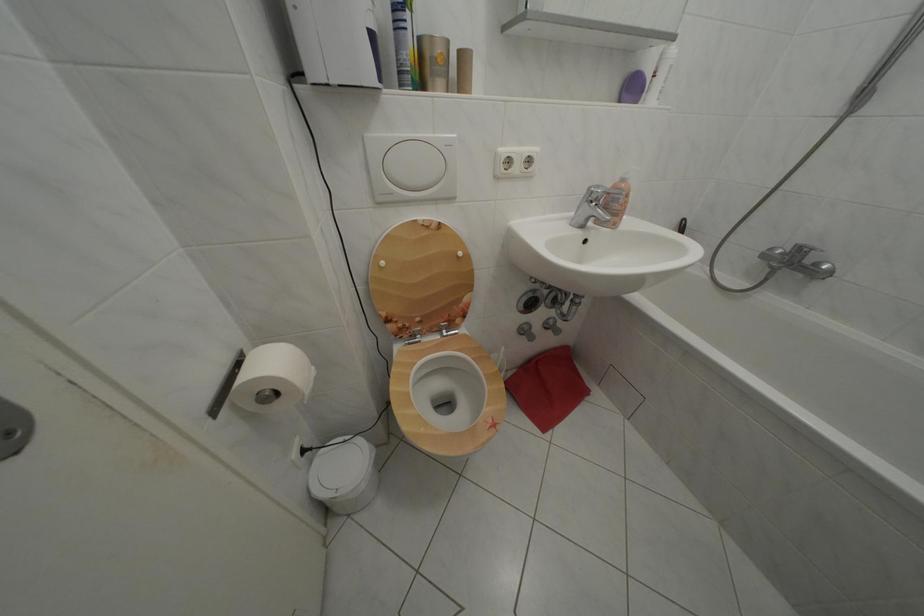
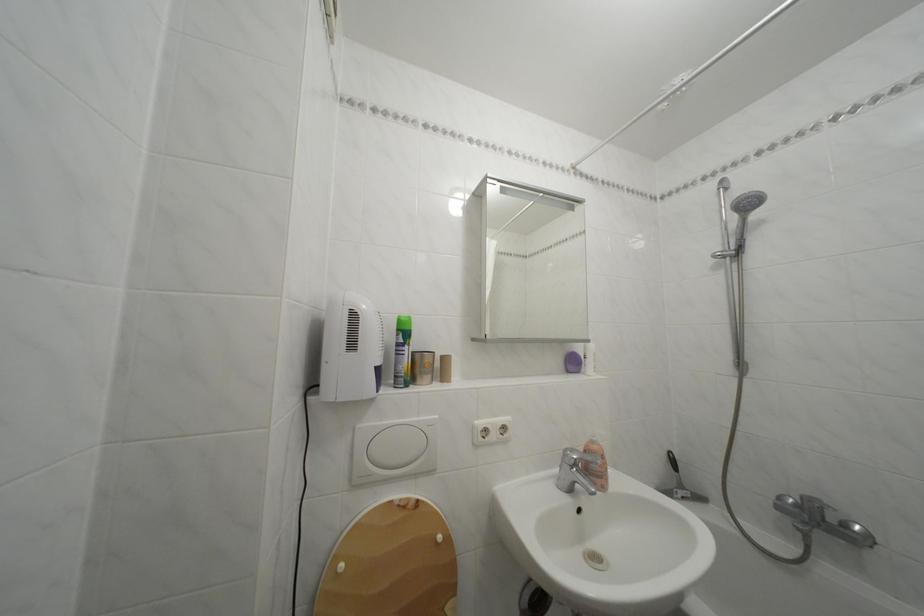
Where in the second image is the point corresponding to point (631, 187) from the first image?

(602, 448)